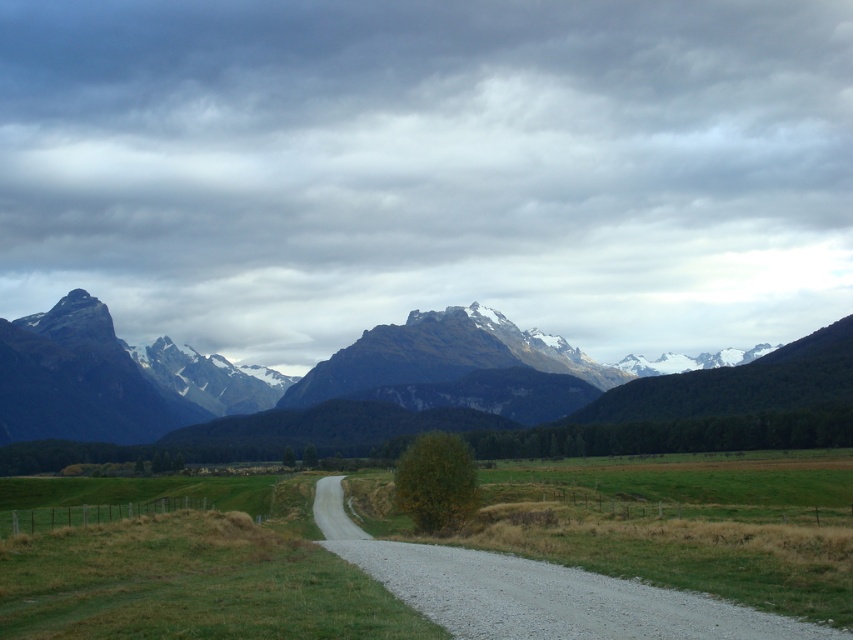
Question: Can you confirm if gray gravel road at center is positioned below gravel road at center?

Choices:
 (A) no
 (B) yes

Answer: (A)

Question: Which point is closer to the camera?

Choices:
 (A) gray gravel road at center
 (B) snowy granite mountain at center
 (C) snowy rocky mountain range at center
 (D) gravel road at center

Answer: (A)

Question: Which point appears closest to the camera in this image?

Choices:
 (A) (605, 586)
 (B) (322, 512)

Answer: (A)

Question: From the image, what is the correct spatial relationship of snowy rocky mountain range at center in relation to gravel road at center?

Choices:
 (A) right
 (B) left

Answer: (A)

Question: Which of the following is the farthest from the observer?

Choices:
 (A) (314, 384)
 (B) (42, 451)

Answer: (B)

Question: Is snowy rocky mountain range at center above gray gravel road at center?

Choices:
 (A) no
 (B) yes

Answer: (B)